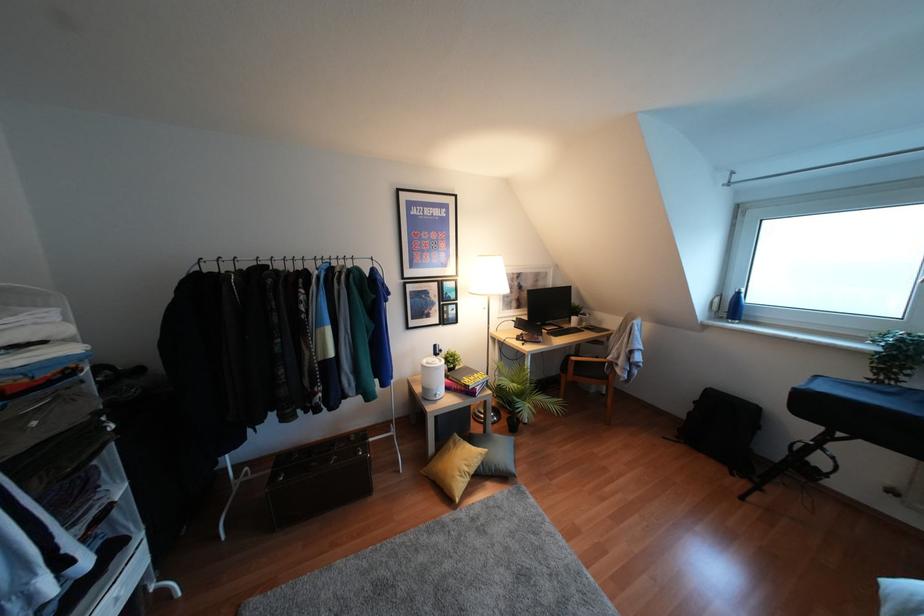
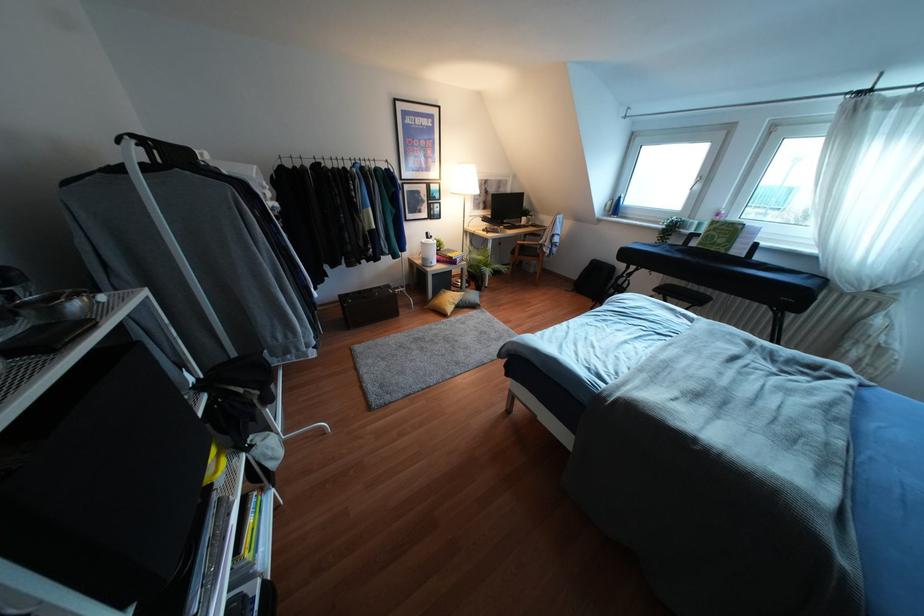
The point at (434, 345) is marked in the first image. Where is the corresponding point in the second image?

(427, 233)